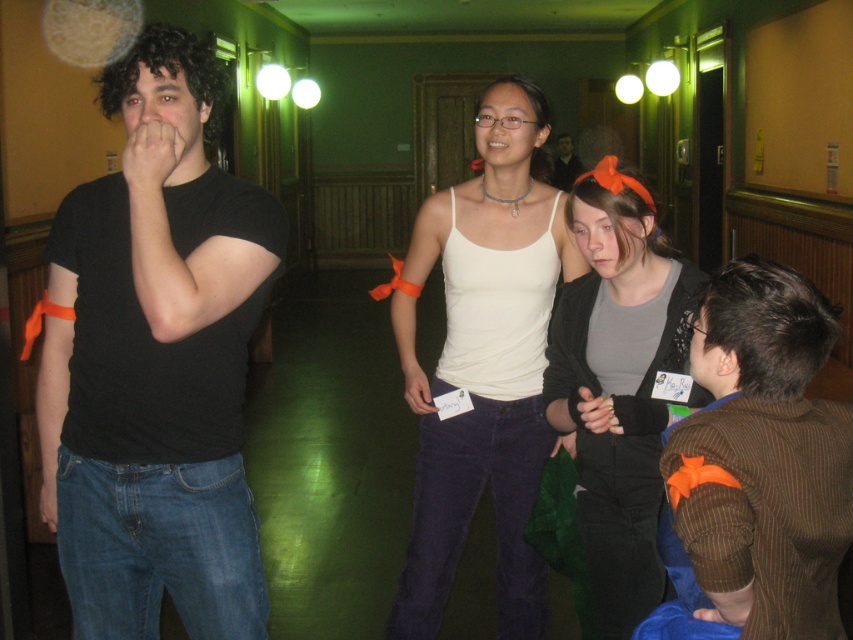
Question: Can you confirm if white cotton tank top at center is wider than brown pinstripe sweater at lower right?

Choices:
 (A) no
 (B) yes

Answer: (B)

Question: Estimate the real-world distances between objects in this image. Which object is closer to the brown pinstripe sweater at lower right?

Choices:
 (A) black matte t-shirt at left
 (B) matte black shirt at center
 (C) matte gray sweater at center

Answer: (C)

Question: Is white cotton tank top at center behind matte black shirt at center?

Choices:
 (A) no
 (B) yes

Answer: (A)

Question: Can you confirm if white cotton tank top at center is positioned above brown pinstripe sweater at lower right?

Choices:
 (A) no
 (B) yes

Answer: (B)

Question: Among these points, which one is nearest to the camera?

Choices:
 (A) (154, 308)
 (B) (775, 582)
 (C) (537, 392)

Answer: (B)

Question: Which point is farther from the camera taking this photo?

Choices:
 (A) (567, 168)
 (B) (631, 518)
 (C) (747, 621)
 (D) (447, 465)

Answer: (A)